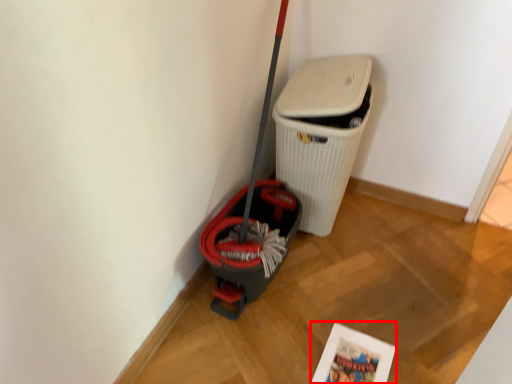
Question: From the image's perspective, considering the relative positions of comic book (annotated by the red box) and waste container in the image provided, where is comic book (annotated by the red box) located with respect to the staircase?

Choices:
 (A) above
 (B) below

Answer: (B)